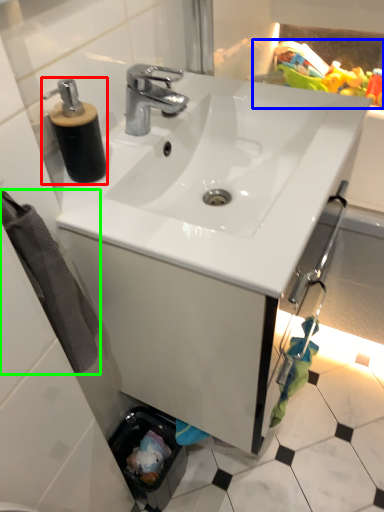
Question: Estimate the real-world distances between objects in this image. Which object is farther from soap dispenser (highlighted by a red box), toy (highlighted by a blue box) or bath towel (highlighted by a green box)?

Choices:
 (A) toy
 (B) bath towel

Answer: (A)